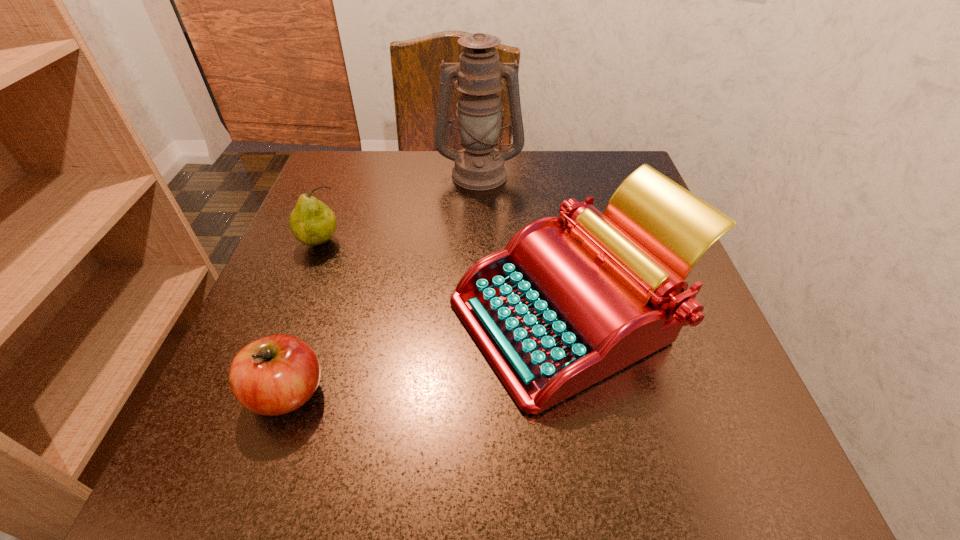
Where is `free spot located on the back of the apple`? free spot located on the back of the apple is located at coordinates (331, 266).

At what (x,y) coordinates should I click in order to perform the action: click on object that is at the far edge. Please return your answer as a coordinate pair (x, y). Image resolution: width=960 pixels, height=540 pixels. Looking at the image, I should click on coord(479,166).

Where is `pear at the left edge`? pear at the left edge is located at coordinates (312, 223).

You are a GUI agent. You are given a task and a screenshot of the screen. Output one action in this format:
    pyautogui.click(x=<x>, y=<y>)
    Task: Click on the apple situated at the left edge
    Image resolution: width=960 pixels, height=540 pixels.
    Given the screenshot: What is the action you would take?
    pyautogui.click(x=275, y=375)

In order to click on object located at the right edge in this screenshot , I will do `click(558, 310)`.

Image resolution: width=960 pixels, height=540 pixels. In the image, there is a desktop. In order to click on free region at the far edge in this screenshot , I will do `click(540, 180)`.

This screenshot has height=540, width=960. Identify the location of free region at the near edge of the desktop. (384, 435).

Where is `free point at the left edge`? free point at the left edge is located at coordinates (221, 413).

Locate an element on the screen. The height and width of the screenshot is (540, 960). free space at the right edge of the desktop is located at coordinates (722, 355).

In the image, there is a desktop. Where is `blank space at the far left corner`? blank space at the far left corner is located at coordinates [x=381, y=198].